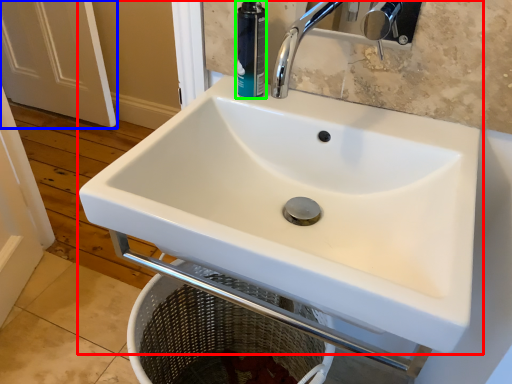
Question: Based on their relative distances, which object is nearer to sink (highlighted by a red box)? Choose from screen door (highlighted by a blue box) and toiletry (highlighted by a green box).

Choices:
 (A) screen door
 (B) toiletry

Answer: (B)